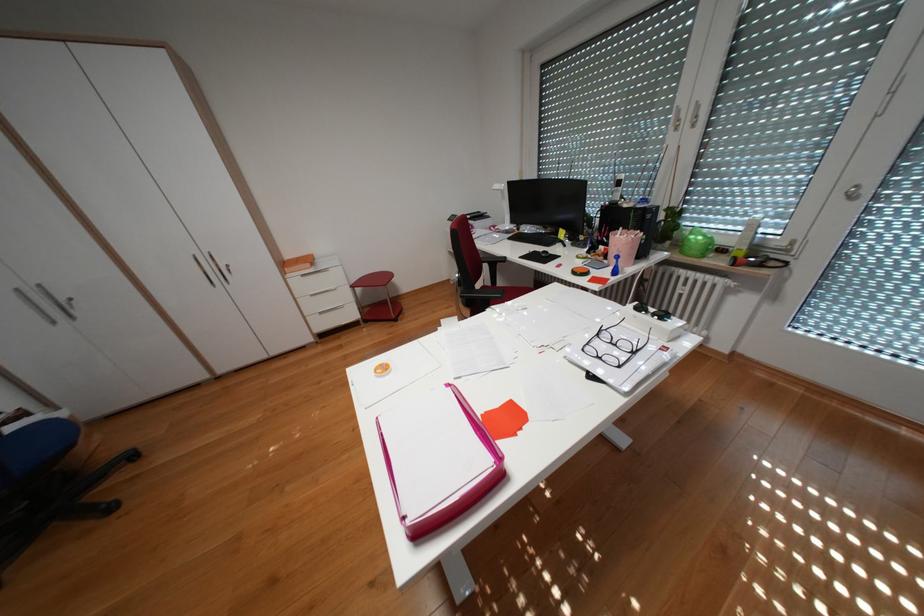
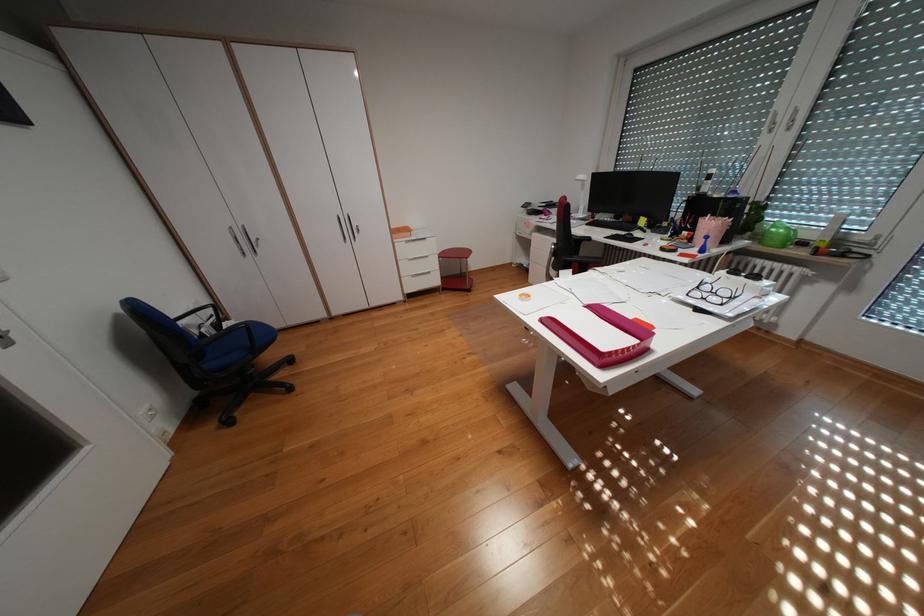
Question: The images are taken continuously from a first-person perspective. In which direction is your viewpoint rotating?

Choices:
 (A) Left
 (B) Right
 (C) Up
 (D) Down

Answer: (A)